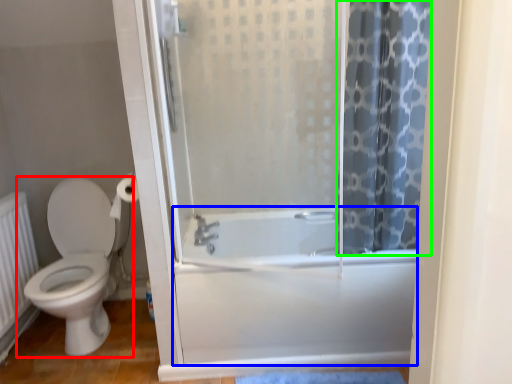
Question: Based on their relative distances, which object is nearer to toilet (highlighted by a red box)? Choose from bath (highlighted by a blue box) and shower curtain (highlighted by a green box).

Choices:
 (A) bath
 (B) shower curtain

Answer: (A)